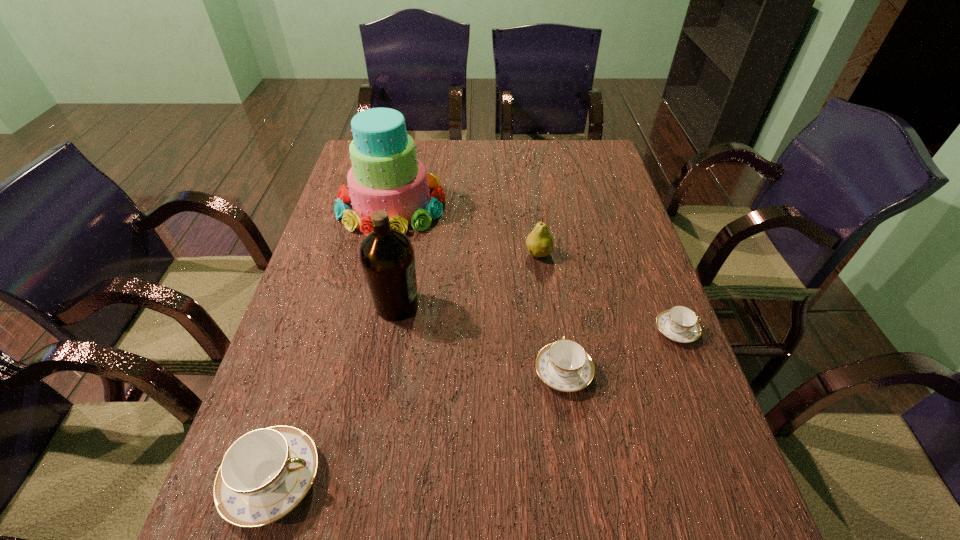
Identify the location of free space located 0.360m on the side with the handle of the tallest teacup. (520, 479).

Identify the location of vacant space located 0.160m on the side with the handle of the second teacup from right to left. (552, 295).

Locate an element on the screen. The width and height of the screenshot is (960, 540). vacant space positioned 0.090m on the side with the handle of the second teacup from right to left is located at coordinates (555, 316).

You are a GUI agent. You are given a task and a screenshot of the screen. Output one action in this format:
    pyautogui.click(x=<x>, y=<y>)
    Task: Click on the vacant space located 0.170m on the side with the handle of the second teacup from right to left
    The height and width of the screenshot is (540, 960).
    Given the screenshot: What is the action you would take?
    pyautogui.click(x=552, y=292)

In order to click on vacant area situated on the right of the fifth nearest object in this screenshot , I will do `click(607, 253)`.

Where is `blank space located on the back of the cake`? blank space located on the back of the cake is located at coordinates (400, 167).

Locate an element on the screen. The width and height of the screenshot is (960, 540). vacant space located 0.110m on the label of the olive oil is located at coordinates (466, 305).

I want to click on object that is at the far edge, so click(386, 175).

The image size is (960, 540). In order to click on object that is positioned at the near edge in this screenshot , I will do point(266,473).

The height and width of the screenshot is (540, 960). I want to click on teacup that is at the left edge, so click(x=266, y=473).